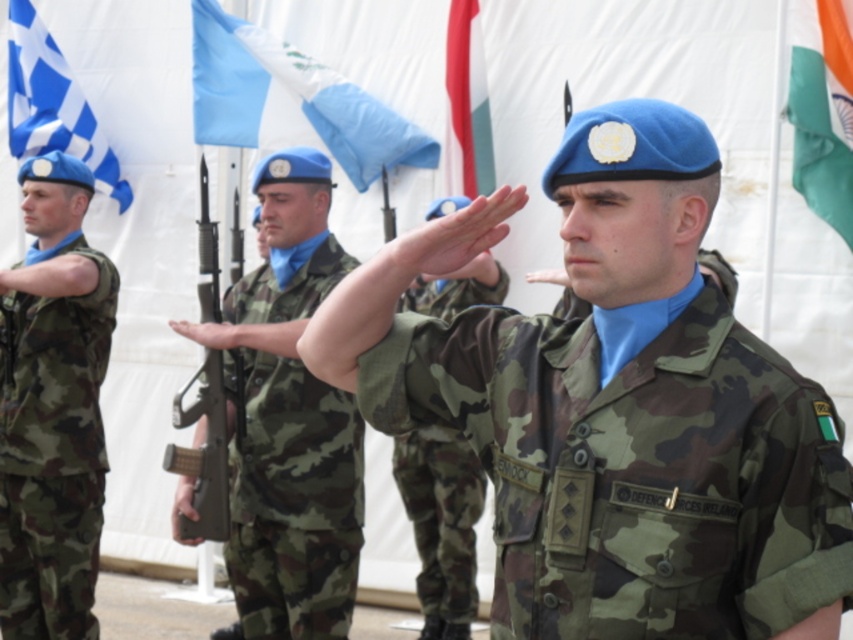
Question: Does blue fabric flag at upper center have a larger size compared to blue fabric flag at upper left?

Choices:
 (A) no
 (B) yes

Answer: (B)

Question: From the image, what is the correct spatial relationship of camo fabric uniform at left in relation to camo fabric uniform at center?

Choices:
 (A) left
 (B) right

Answer: (A)

Question: Among these objects, which one is farthest from the camera?

Choices:
 (A) red fabric flag at upper center
 (B) camo uniform at center
 (C) camo fabric uniform at center

Answer: (A)

Question: Among these points, which one is farthest from the camera?

Choices:
 (A) (x=218, y=42)
 (B) (x=241, y=125)

Answer: (A)

Question: Considering the real-world distances, which object is farthest from the blue checkered flag at upper left?

Choices:
 (A) camo fabric jacket at center
 (B) camo uniform at center
 (C) blue fabric flag at upper left

Answer: (A)

Question: Does blue checkered flag at upper left lie in front of blue fabric flag at upper left?

Choices:
 (A) yes
 (B) no

Answer: (B)